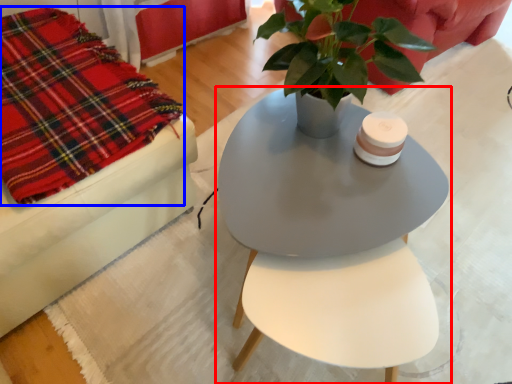
Question: Which point is further to the camera, table (highlighted by a red box) or cloth (highlighted by a blue box)?

Choices:
 (A) table
 (B) cloth

Answer: (B)